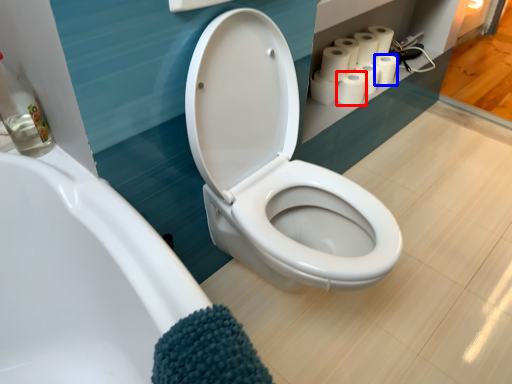
Question: Which point is closer to the camera, paper towel (highlighted by a red box) or toilet paper (highlighted by a blue box)?

Choices:
 (A) paper towel
 (B) toilet paper

Answer: (A)